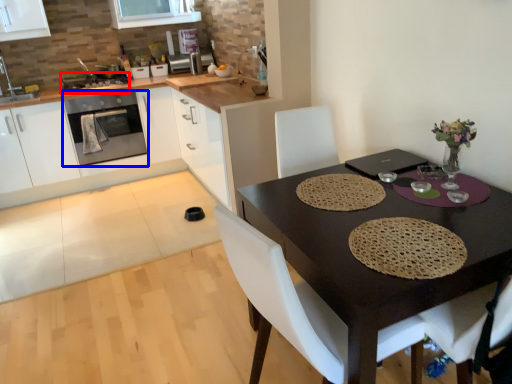
Question: Which of the following is the farthest to the observer, appliance (highlighted by a red box) or kitchen appliance (highlighted by a blue box)?

Choices:
 (A) appliance
 (B) kitchen appliance

Answer: (A)